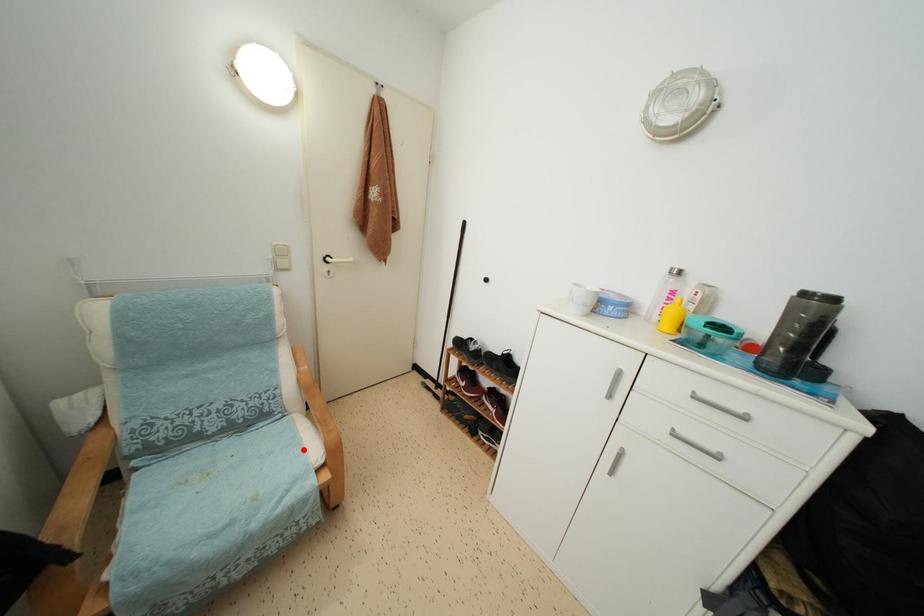
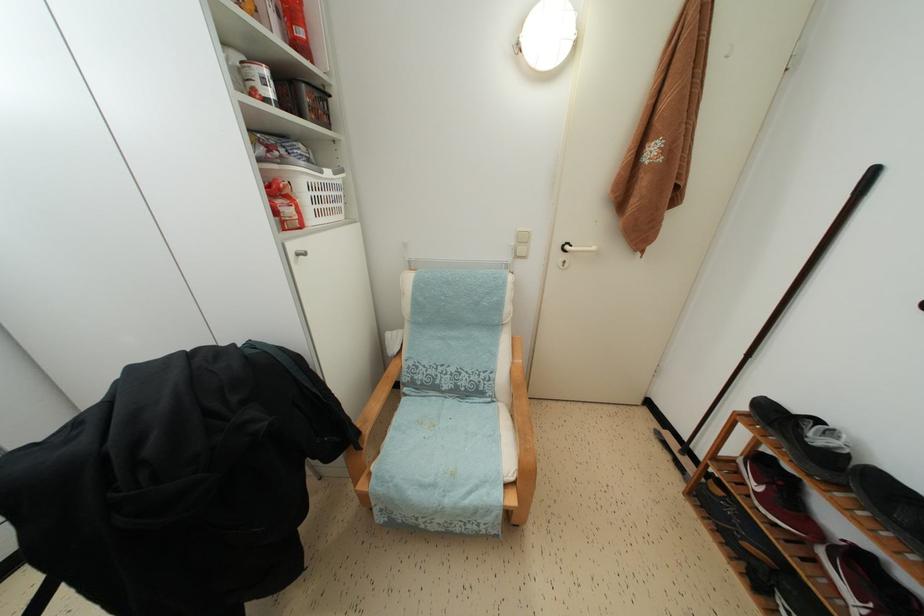
Find the pixel in the second image that matches the highlighted location in the first image.

(502, 447)